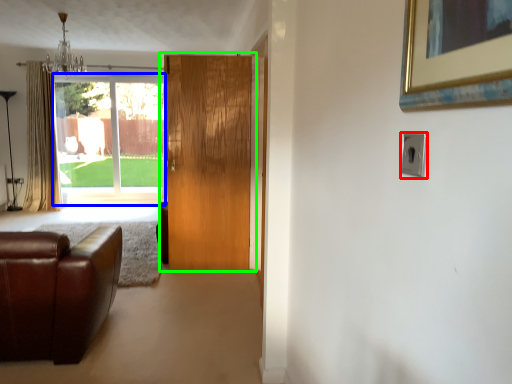
Question: Based on their relative distances, which object is nearer to electric outlet (highlighted by a red box)? Choose from window (highlighted by a blue box) and door (highlighted by a green box).

Choices:
 (A) window
 (B) door

Answer: (B)